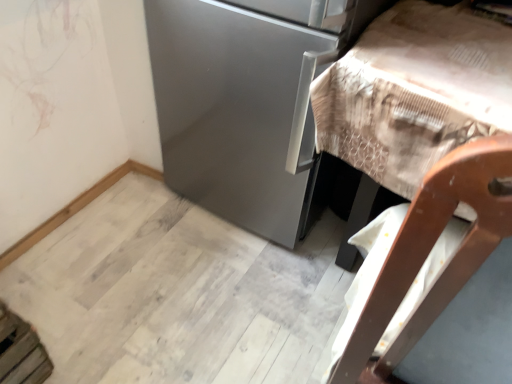
Question: From a real-world perspective, relative to wooden chair at right, is satin silver refrigerator at center vertically above or below?

Choices:
 (A) above
 (B) below

Answer: (B)

Question: Considering the positions of satin silver refrigerator at center and wooden chair at right in the image, is satin silver refrigerator at center wider or thinner than wooden chair at right?

Choices:
 (A) wide
 (B) thin

Answer: (B)

Question: In terms of height, does satin silver refrigerator at center look taller or shorter compared to wooden chair at right?

Choices:
 (A) tall
 (B) short

Answer: (A)

Question: Is wooden chair at right inside the boundaries of satin silver refrigerator at center, or outside?

Choices:
 (A) outside
 (B) inside

Answer: (A)

Question: From the image's perspective, is wooden chair at right above or below satin silver refrigerator at center?

Choices:
 (A) above
 (B) below

Answer: (B)

Question: In terms of width, does wooden chair at right look wider or thinner when compared to satin silver refrigerator at center?

Choices:
 (A) wide
 (B) thin

Answer: (A)

Question: From a real-world perspective, relative to satin silver refrigerator at center, is wooden chair at right vertically above or below?

Choices:
 (A) above
 (B) below

Answer: (A)